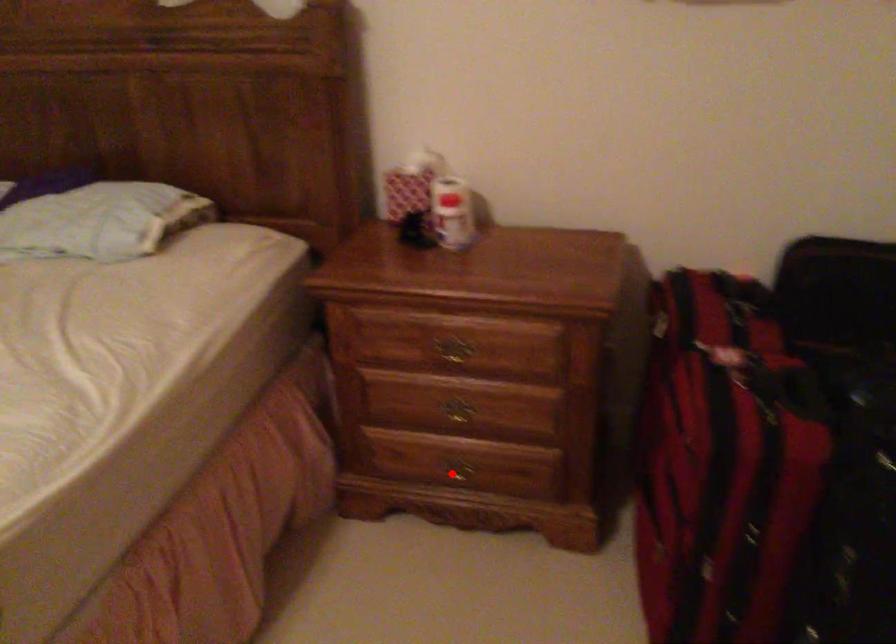
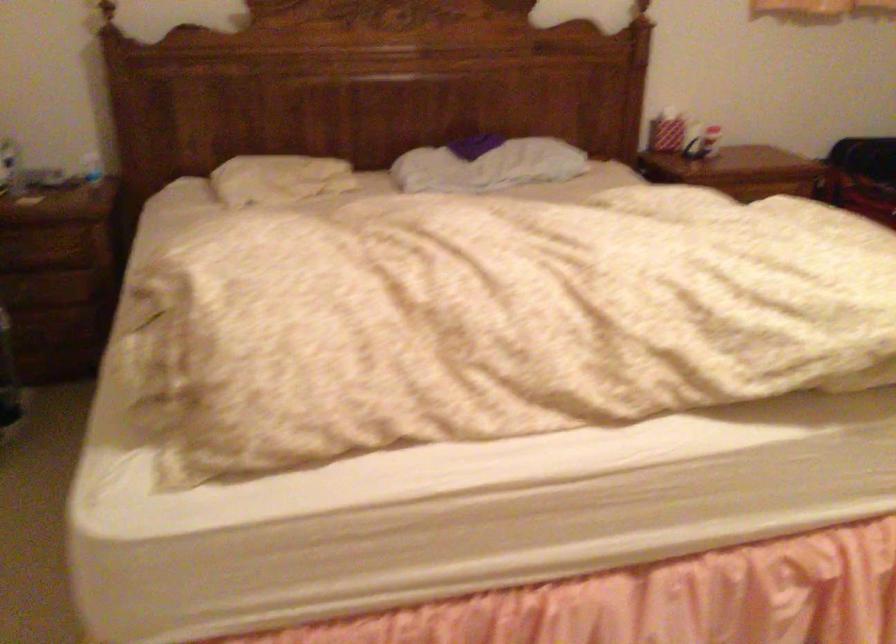
Question: I am providing you with two images of the same scene from different viewpoints. A red point is marked on the first image. At the location where the point appears in image 1, is it still visible in image 2?

Choices:
 (A) Yes
 (B) No

Answer: (B)